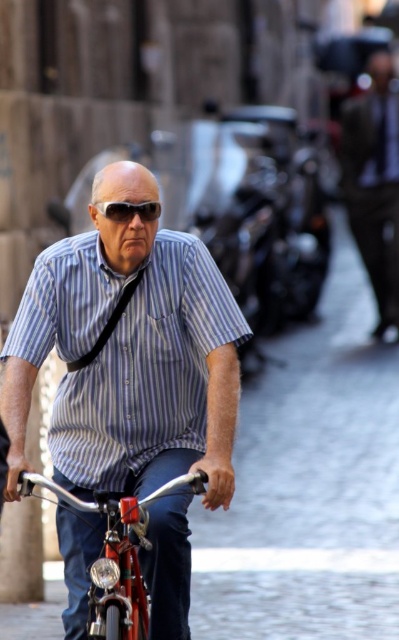
Question: Which of the following is the closest to the observer?

Choices:
 (A) (169, 260)
 (B) (154, 204)

Answer: (B)

Question: Can you confirm if shiny metallic bicycle at center is wider than matte black sunglasses at center?

Choices:
 (A) yes
 (B) no

Answer: (A)

Question: Which point is farther from the camera taking this photo?

Choices:
 (A) (148, 202)
 (B) (53, 483)
 (C) (59, 312)
 (D) (367, 99)

Answer: (D)

Question: Which object is the farthest from the blue striped shirt at center?

Choices:
 (A) dark brown leather jacket at upper right
 (B) matte black sunglasses at center
 (C) shiny metallic bicycle at center

Answer: (A)

Question: Does blue striped shirt at center have a greater width compared to matte black sunglasses at center?

Choices:
 (A) yes
 (B) no

Answer: (A)

Question: Is blue striped shirt at center bigger than shiny metallic bicycle at center?

Choices:
 (A) no
 (B) yes

Answer: (B)